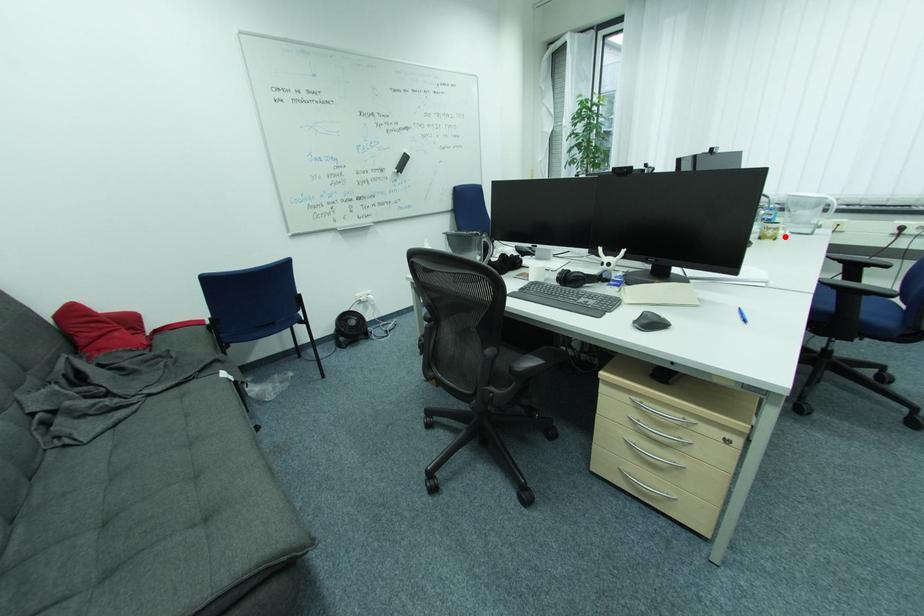
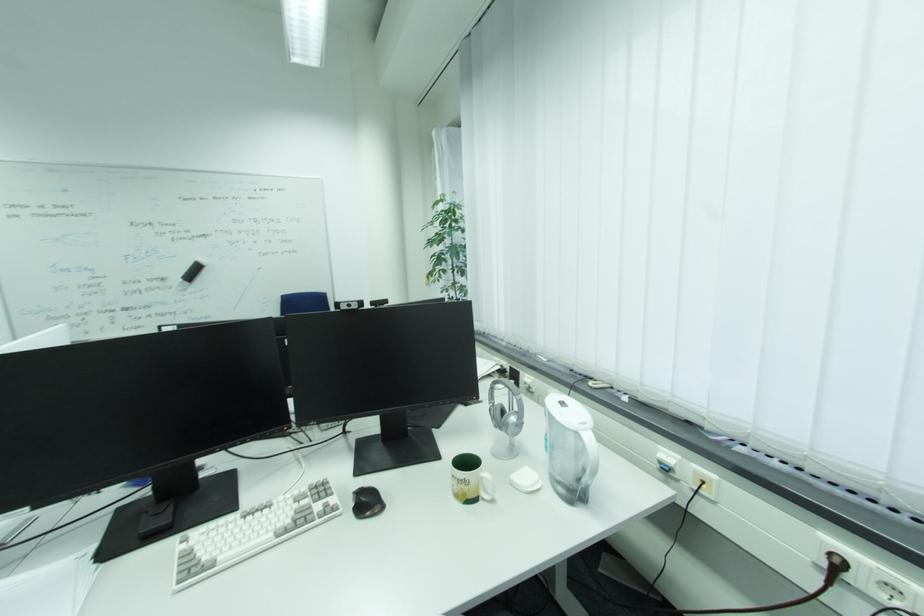
Find the pixel in the second image that matches the highlighted location in the first image.

(490, 496)